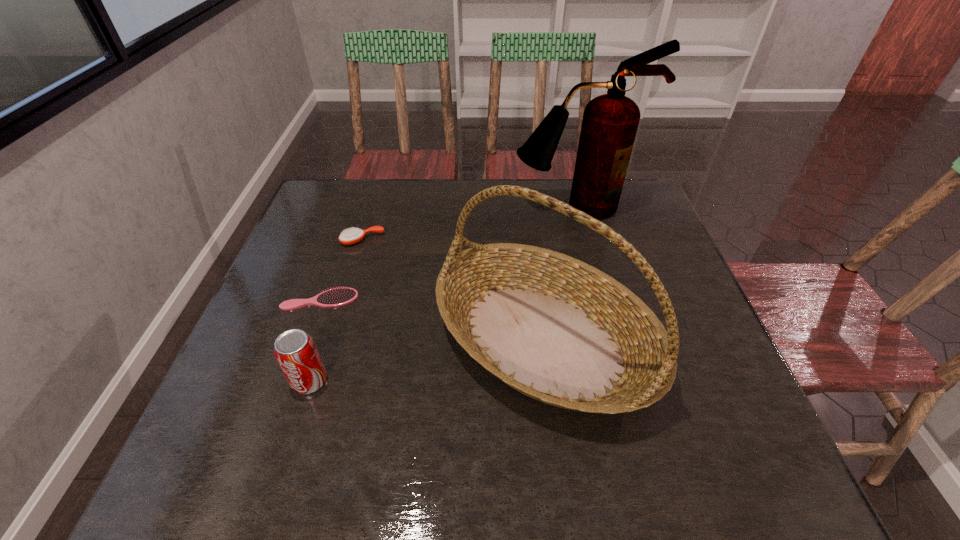
Find the location of `the farthest object`. the farthest object is located at coordinates (610, 121).

At what (x,y) coordinates should I click in order to perform the action: click on fire extinguisher. Please return your answer as a coordinate pair (x, y). Looking at the image, I should click on (610, 121).

Where is `the fourth shortest object`? the fourth shortest object is located at coordinates (558, 330).

Find the location of a particular element. This screenshot has height=540, width=960. the third tallest object is located at coordinates (295, 351).

Identify the location of the second farthest object. (349, 236).

Where is `the second shortest object`? the second shortest object is located at coordinates (349, 236).

This screenshot has height=540, width=960. What are the coordinates of `the shorter hairbrush` in the screenshot? It's located at (336, 297).

Find the location of a particular element. the nearer hairbrush is located at coordinates (336, 297).

Locate an element on the screen. vacant region located 0.150m at the nozzle of the tallest object is located at coordinates (588, 255).

You are a GUI agent. You are given a task and a screenshot of the screen. Output one action in this format:
    pyautogui.click(x=<x>, y=<y>)
    Task: Click on the free location located 0.280m on the left of the fourth shortest object
    The image size is (960, 540).
    Given the screenshot: What is the action you would take?
    pyautogui.click(x=307, y=339)